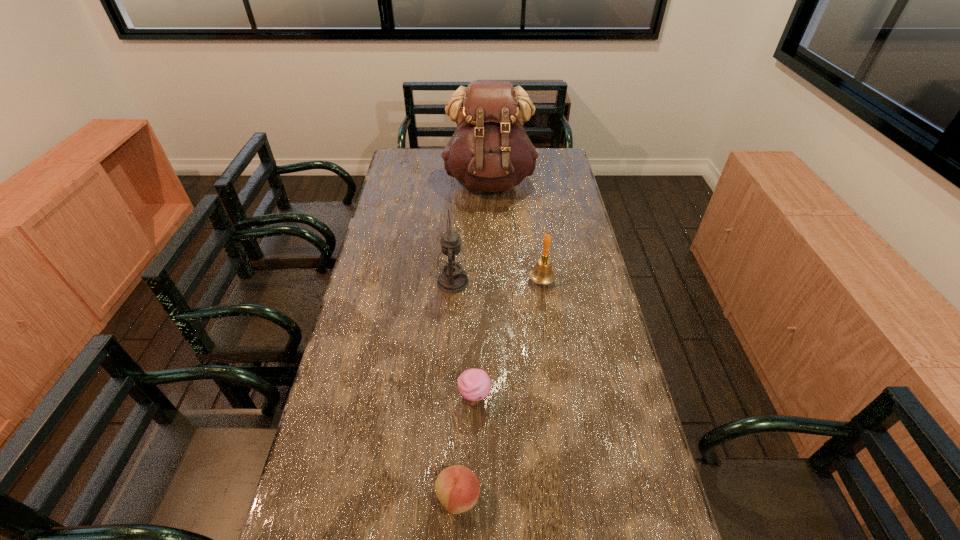
Identify the location of vacant area that lies between the cupcake and the third shortest object. (508, 339).

Image resolution: width=960 pixels, height=540 pixels. I want to click on free point between the peach and the cupcake, so click(x=467, y=448).

What are the coordinates of `free space between the peach and the bell` in the screenshot? It's located at (500, 389).

The width and height of the screenshot is (960, 540). In order to click on unoccupied position between the oil lamp and the farthest object in this screenshot , I will do `click(471, 232)`.

Where is `vacant area that lies between the nearest object and the fourth farthest object`? The image size is (960, 540). vacant area that lies between the nearest object and the fourth farthest object is located at coordinates (467, 448).

This screenshot has height=540, width=960. I want to click on empty space between the satchel and the fourth shortest object, so click(x=471, y=232).

Identify the location of object that is the third closest to the farthest object. (474, 385).

Locate an element on the screen. object identified as the closest to the satchel is located at coordinates (452, 279).

The height and width of the screenshot is (540, 960). Find the location of `vacant area in the image that satisfies the following two spatial constraints: 1. on the back side of the bell; 2. on the right side of the oil lamp`. vacant area in the image that satisfies the following two spatial constraints: 1. on the back side of the bell; 2. on the right side of the oil lamp is located at coordinates (453, 280).

The width and height of the screenshot is (960, 540). In order to click on vacant region that satisfies the following two spatial constraints: 1. on the back side of the nearest object; 2. on the left side of the cupcake in this screenshot , I will do `click(462, 398)`.